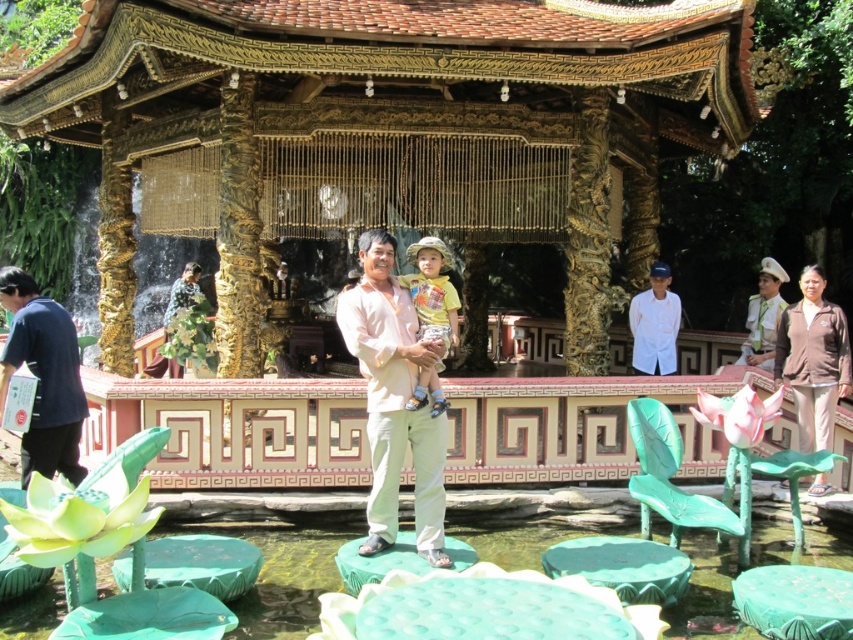
You are a visitor in the garden and want to place your brown matte jacket at lower right on top of the green matte lotus leaf at lower center. Considering their sizes, will the jacket fit entirely on the leaf without hanging over the edges?

The brown matte jacket at lower right is larger than the green matte lotus leaf at lower center, so placing the jacket on the leaf would cause it to hang over the edges since the leaf is smaller in size.

You are standing in front of the pavilion and want to take a photo. There are two points marked in the scene, point (461, 100) and point (793, 404). Which point is closer to your camera lens?

Point (461, 100) is further to the camera than point (793, 404), so the point closer to the camera lens is point (793, 404).